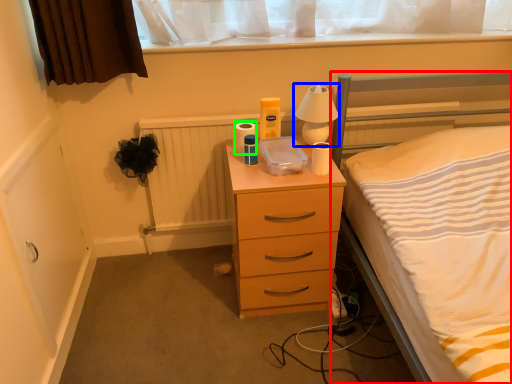
Question: Considering the real-world distances, which object is farthest from bed (highlighted by a red box)? bedside lamp (highlighted by a blue box) or toilet paper (highlighted by a green box)?

Choices:
 (A) bedside lamp
 (B) toilet paper

Answer: (B)